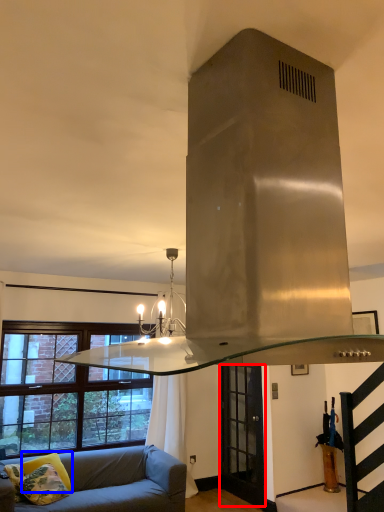
Question: Which of the following is the farthest to the observer, glass door (highlighted by a red box) or pillow (highlighted by a blue box)?

Choices:
 (A) glass door
 (B) pillow

Answer: (A)